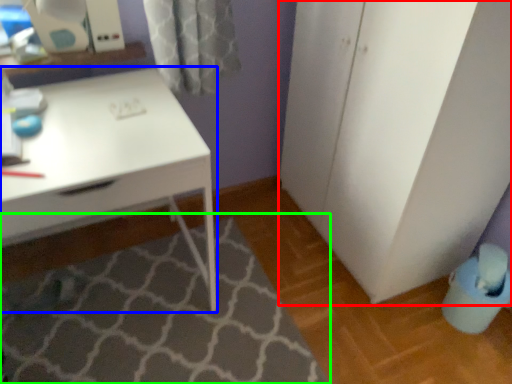
Question: Which is nearer to the file cabinet (highlighted by a red box)? desk (highlighted by a blue box) or bath mat (highlighted by a green box).

Choices:
 (A) desk
 (B) bath mat

Answer: (A)